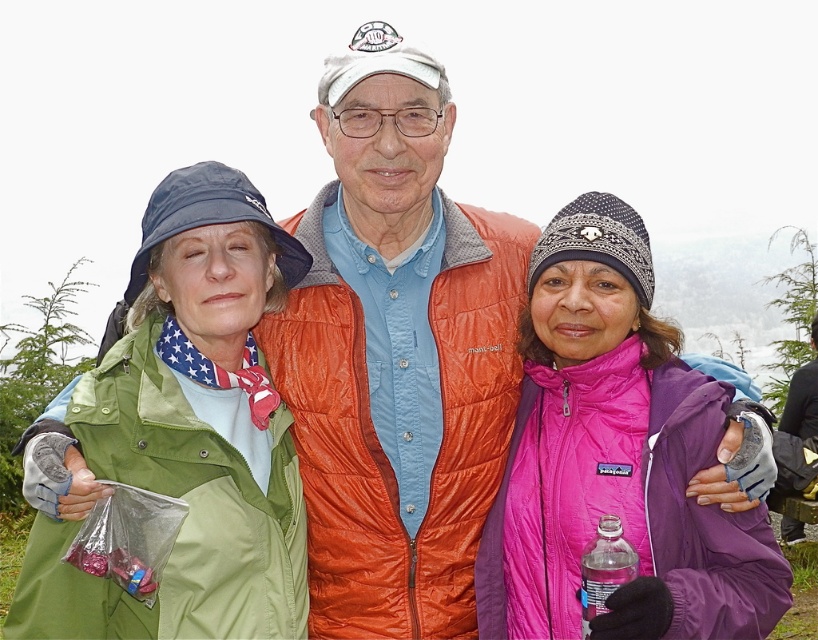
Which is more to the left, green fabric jacket at left or clear plastic bottle at lower right?

green fabric jacket at left

This screenshot has width=818, height=640. Describe the element at coordinates (189, 429) in the screenshot. I see `green fabric jacket at left` at that location.

Locate an element on the screen. Image resolution: width=818 pixels, height=640 pixels. green fabric jacket at left is located at coordinates (189, 429).

The image size is (818, 640). In order to click on green fabric jacket at left in this screenshot , I will do `click(189, 429)`.

Does green fabric jacket at left appear on the left side of pink fleece jacket at center?

Correct, you'll find green fabric jacket at left to the left of pink fleece jacket at center.

This screenshot has width=818, height=640. What do you see at coordinates (189, 429) in the screenshot? I see `green fabric jacket at left` at bounding box center [189, 429].

The width and height of the screenshot is (818, 640). I want to click on green fabric jacket at left, so click(x=189, y=429).

Between pink fleece jacket at center and clear plastic bottle at lower right, which one is positioned lower?

clear plastic bottle at lower right is lower down.

Does pink fleece jacket at center come in front of clear plastic bottle at lower right?

No, pink fleece jacket at center is behind clear plastic bottle at lower right.

Image resolution: width=818 pixels, height=640 pixels. Identify the location of pink fleece jacket at center. (614, 456).

This screenshot has width=818, height=640. Find the location of `pink fleece jacket at center`. pink fleece jacket at center is located at coordinates (614, 456).